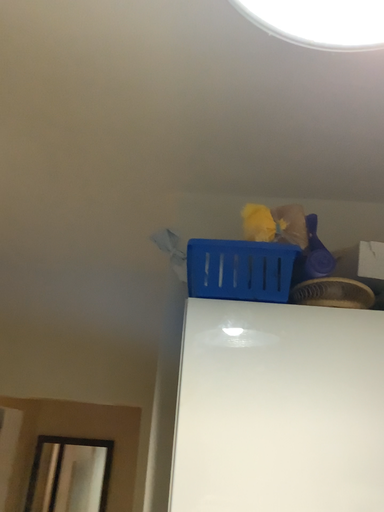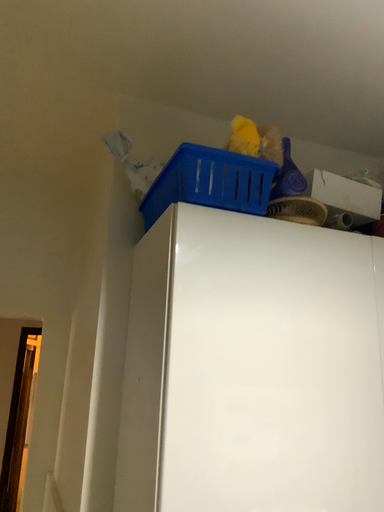
Question: How did the camera likely rotate when shooting the video?

Choices:
 (A) rotated left
 (B) rotated right

Answer: (B)